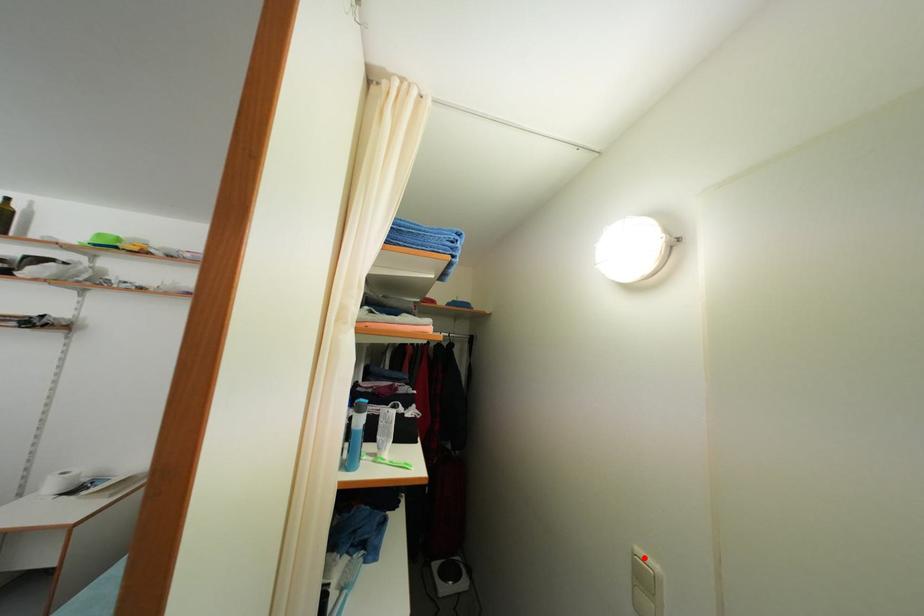
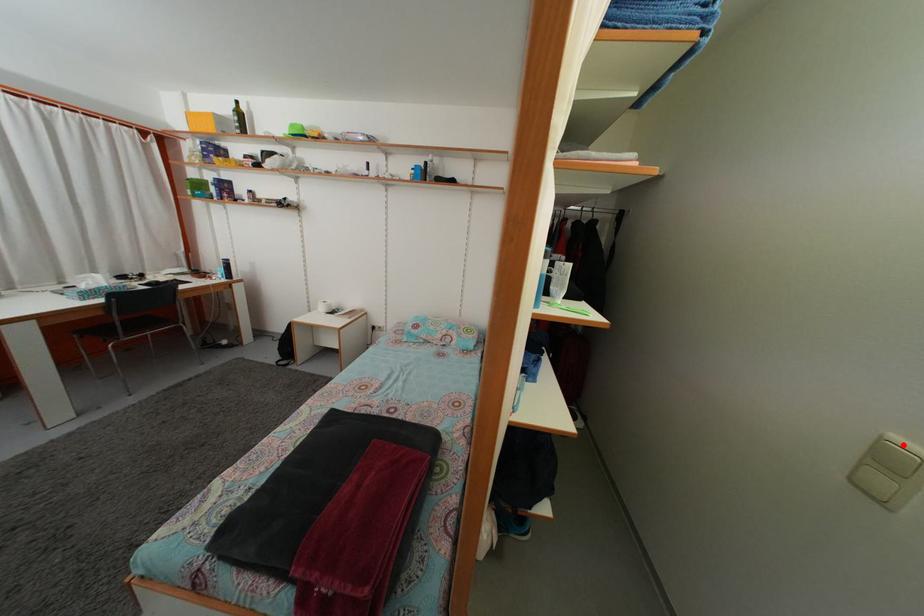
I am providing you with two images of the same scene from different viewpoints. A red point is marked on the first image and another point is marked on the second image. Is the red point in image1 aligned with the point shown in image2?

Yes